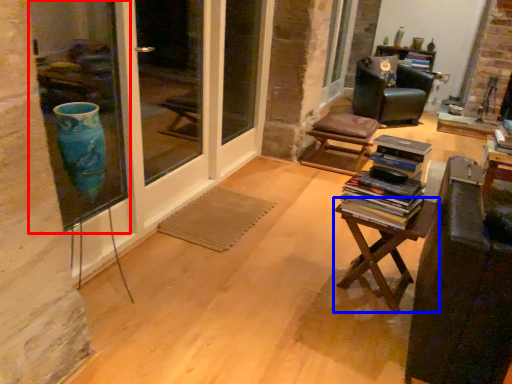
Question: Which object is further to the camera taking this photo, window (highlighted by a red box) or table (highlighted by a blue box)?

Choices:
 (A) window
 (B) table

Answer: (B)